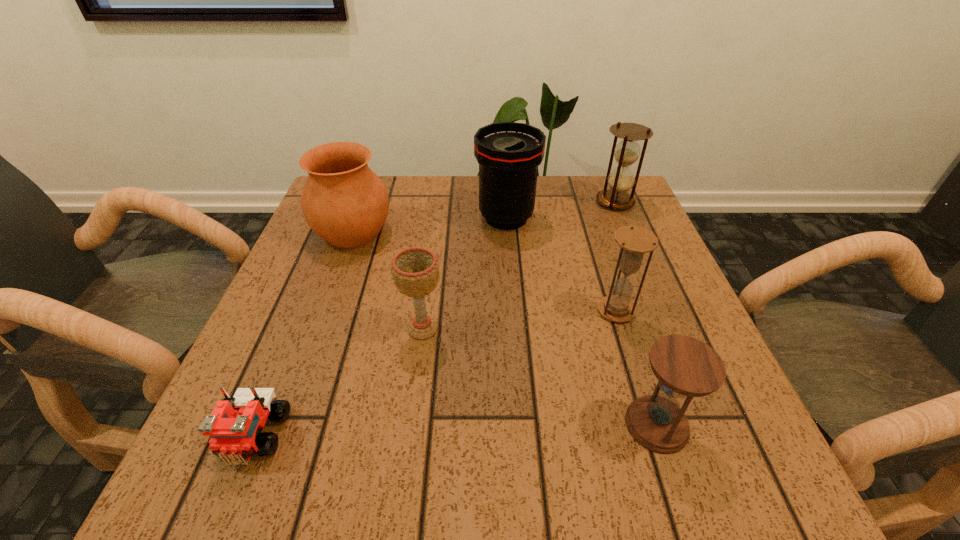
Choose which hourglass is the third nearest neighbor to the pottery. Please provide its 2D coordinates. Your answer should be formatted as a tuple, i.e. [(x, y)], where the tuple contains the x and y coordinates of a point satisfying the conditions above.

[(686, 367)]

Where is `vacant position in the image that satisfies the following two spatial constraints: 1. on the front side of the nearest hourglass; 2. on the left side of the pottery`? The height and width of the screenshot is (540, 960). vacant position in the image that satisfies the following two spatial constraints: 1. on the front side of the nearest hourglass; 2. on the left side of the pottery is located at coordinates (283, 425).